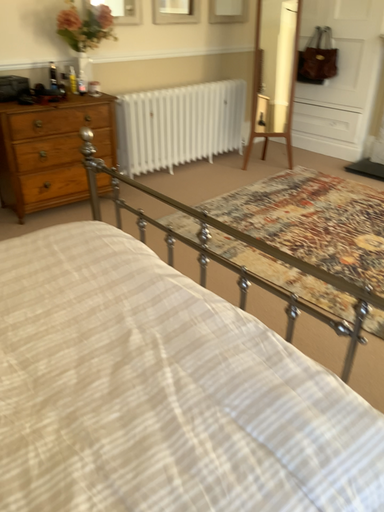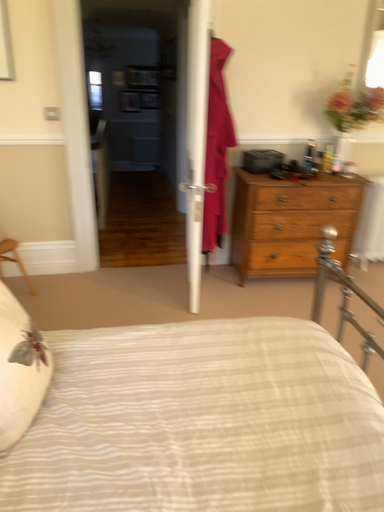
Question: How did the camera likely rotate when shooting the video?

Choices:
 (A) rotated right
 (B) rotated left

Answer: (B)